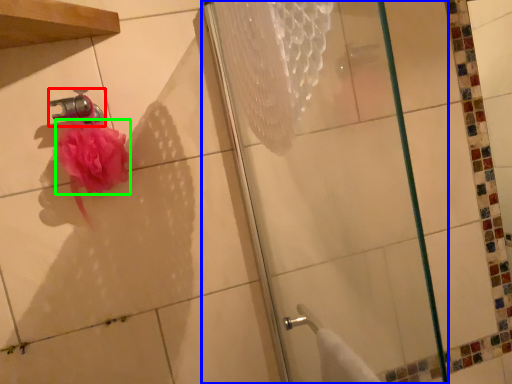
Question: Which object is the closest to the faucet (highlighted by a red box)? Choose among these: shower (highlighted by a blue box) or flower (highlighted by a green box).

Choices:
 (A) shower
 (B) flower

Answer: (B)